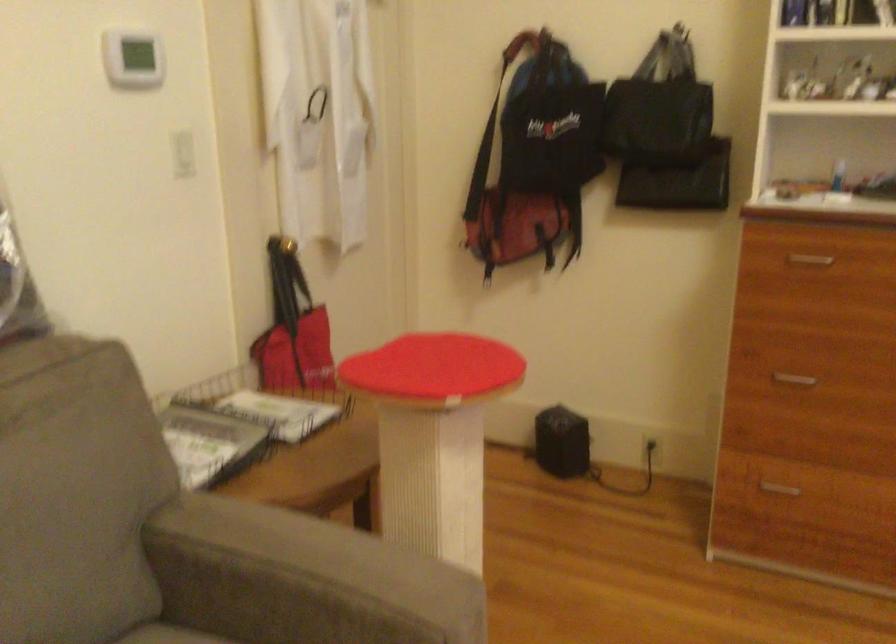
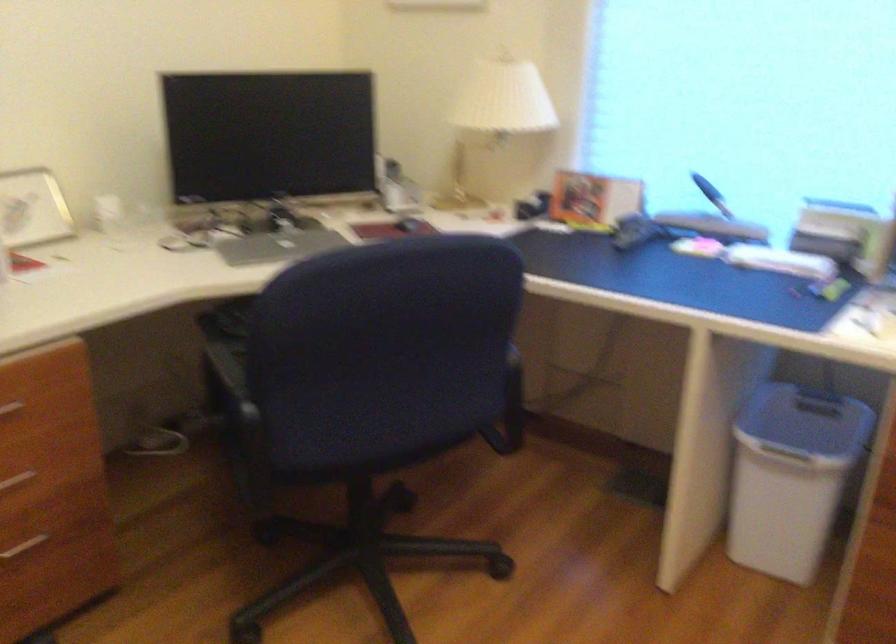
How did the camera likely rotate?

The camera's rotation is toward right-down.